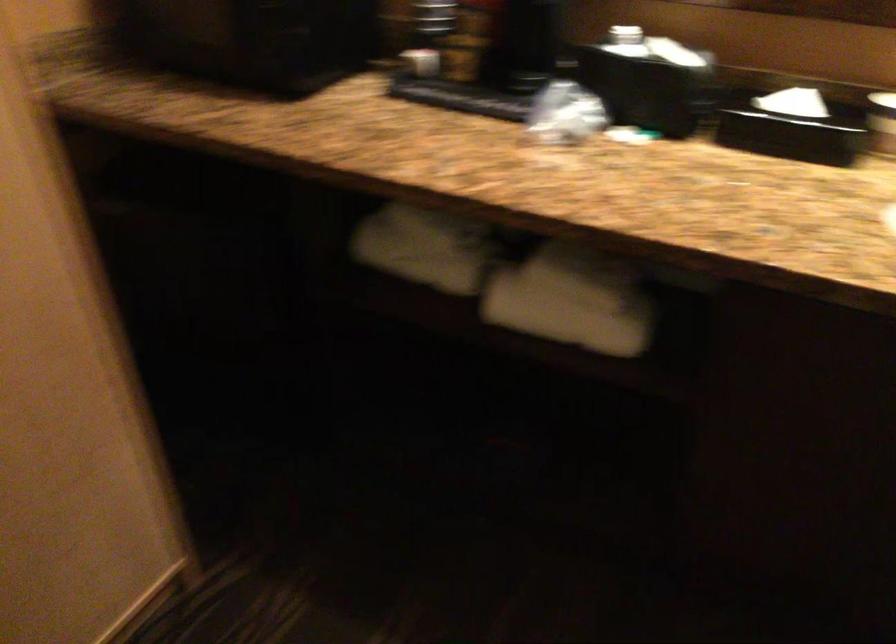
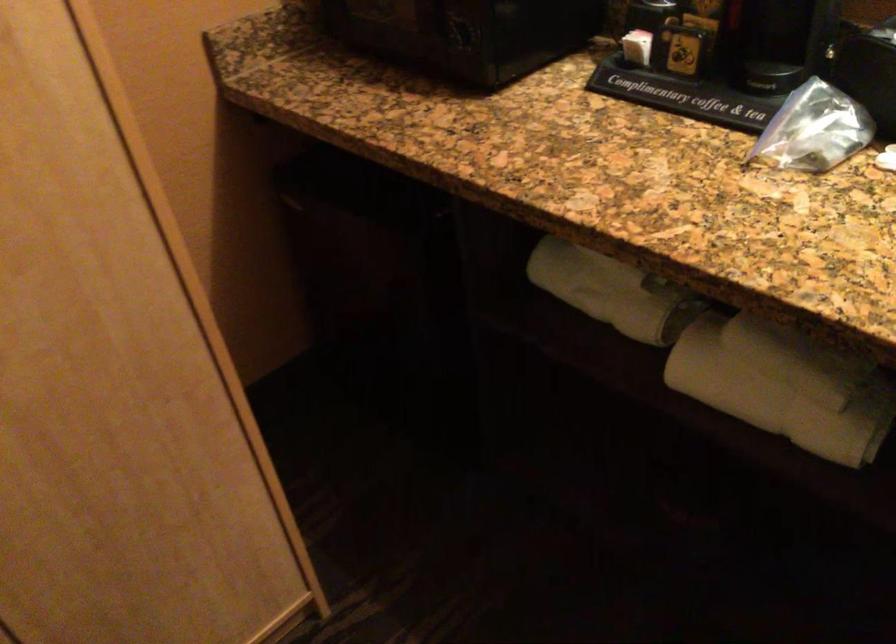
Find the pixel in the second image that matches (570,111) in the first image.

(814, 129)